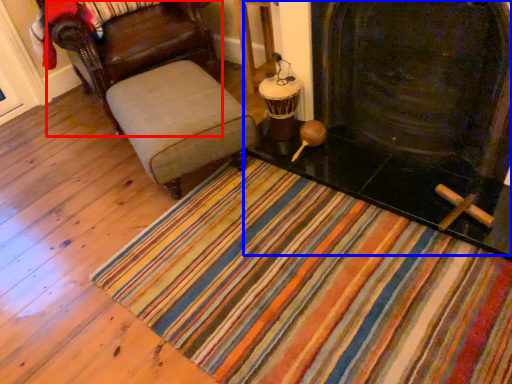
Question: Which object appears farthest to the camera in this image, chair (highlighted by a red box) or fireplace (highlighted by a blue box)?

Choices:
 (A) chair
 (B) fireplace

Answer: (A)